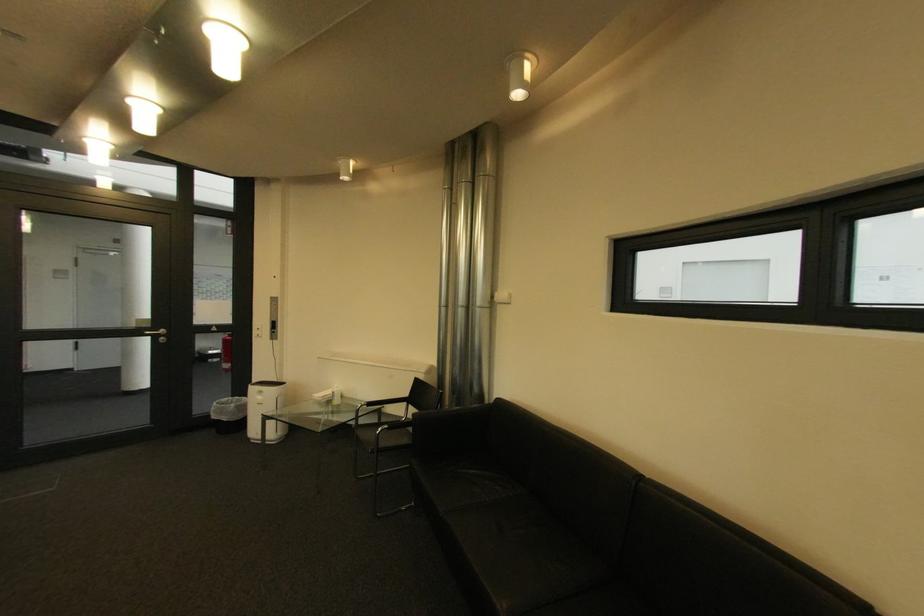
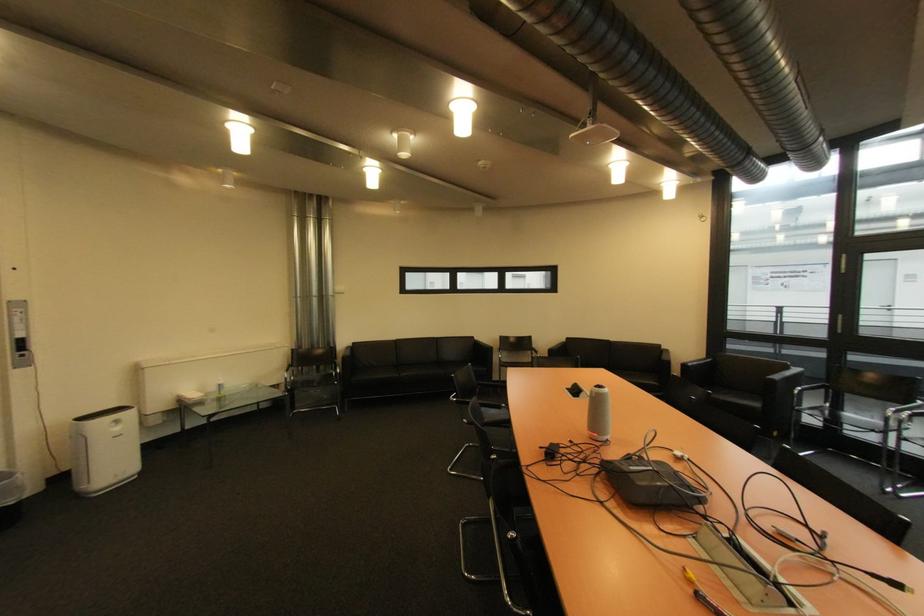
The point at (268, 399) is marked in the first image. Where is the corresponding point in the second image?

(124, 430)